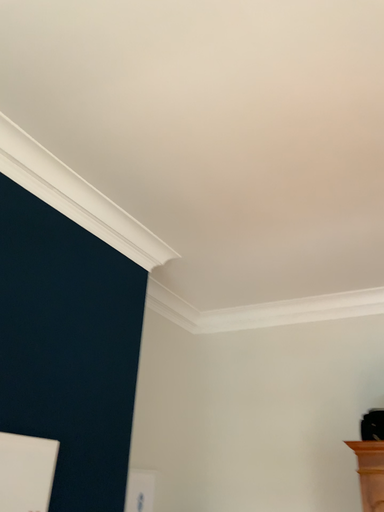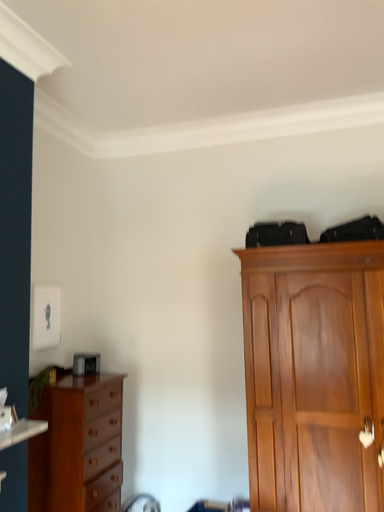
Question: How did the camera likely rotate when shooting the video?

Choices:
 (A) rotated upward
 (B) rotated downward

Answer: (B)